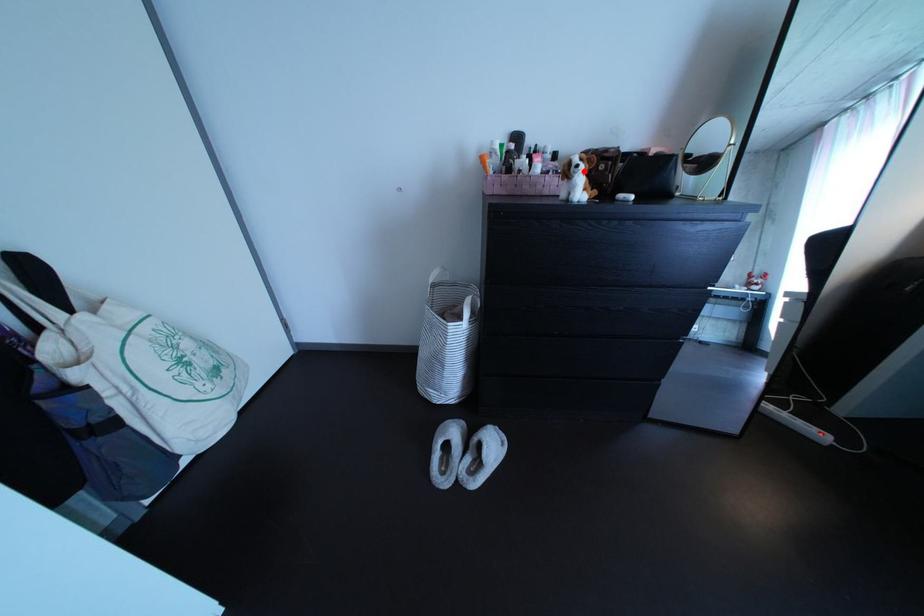
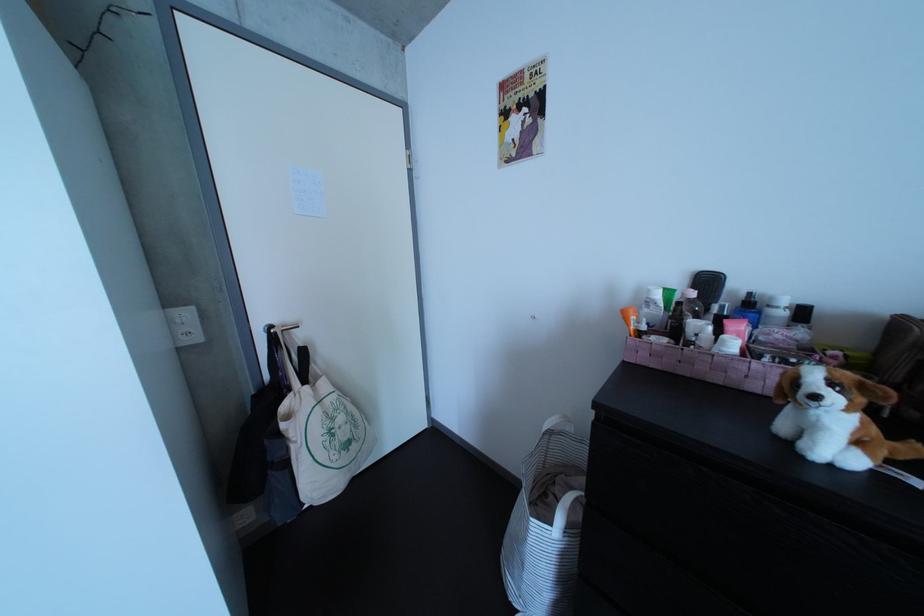
In the second image, find the point that corresponds to the highlighted location in the first image.

(809, 389)